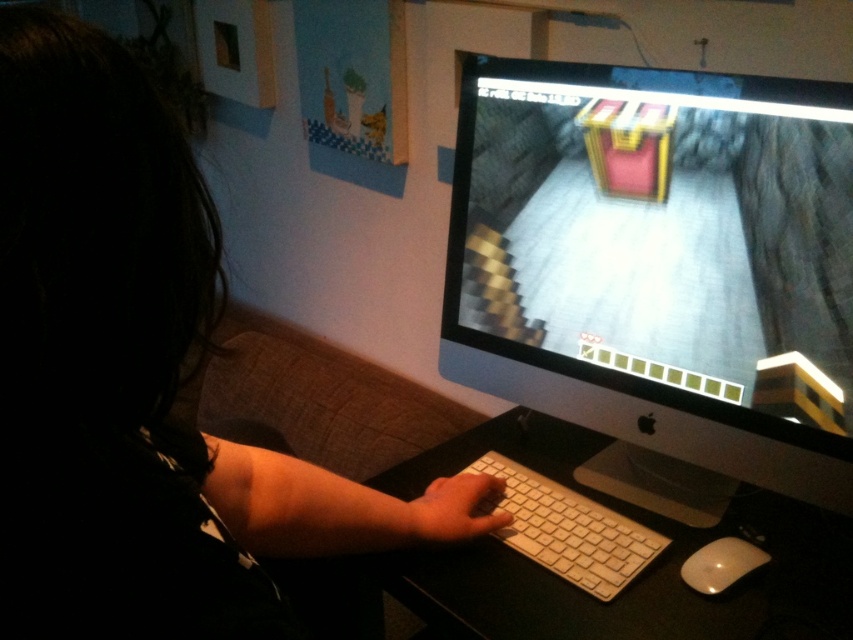
You are a person who wants to reach for the white glossy mouse at lower right while your hand is currently on the white plastic keyboard at center. Which direction should you move your hand to reach the mouse?

You should move your hand to the right to reach the white glossy mouse at lower right since the white plastic keyboard at center is to the left of it.

You are setting up a new desk and want to place a large decorative item between the black plastic monitor at center and the white plastic keyboard at center. Since you want the item to fit properly, will the space between them be sufficient if the item is the same size as the monitor?

The black plastic monitor at center is bigger than the white plastic keyboard at center. Therefore, placing an item as large as the monitor between them may not be possible since the space between them is likely determined by their existing sizes and positions, and the monitor is already larger than the keyboard.

You are a person trying to reach the black plastic monitor at center from the black matte keyboard at lower center. Which direction should you move your hand to reach it?

The black plastic monitor at center is to the right of the black matte keyboard at lower center, so you should move your hand to the right to reach it.